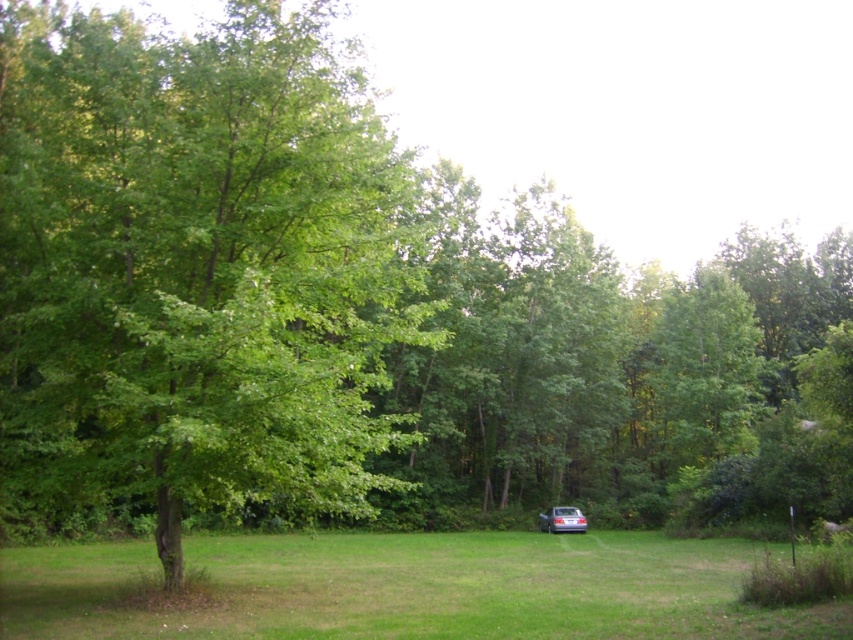
Consider the image. You are standing at the camera position and want to walk to both points. Which point should you reach first, point (241, 120) or point (578, 531)?

You will reach point (241, 120) first because it is closer to the camera than point (578, 531).

You are planning to park your car in the parking lot. You see a green leafy tree at center and a satin silver sedan at center. Which object is wider?

The green leafy tree at center is wider than the satin silver sedan at center according to the description.

You are standing at the origin point of the coordinate system in this outdoor scene. The green leafy tree at center is located at coordinates point 0.417, 0.233. If you want to walk directly to the tree, which direction should you move in?

The green leafy tree at center is located at coordinates point (198, 266), so you should move northeast to reach it.